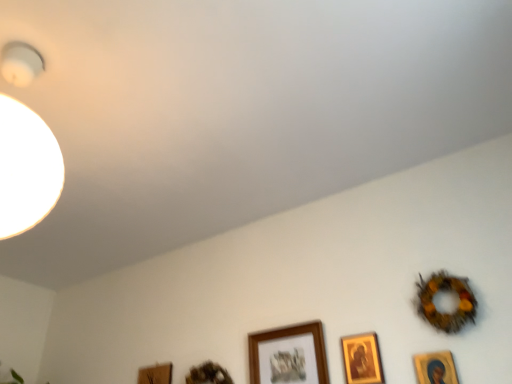
Question: Is gold-framed picture at lower right, arranged as the second picture frame when viewed from the right, shorter than wooden frame at lower center, arranged as the 3th picture frame when viewed from the right?

Choices:
 (A) no
 (B) yes

Answer: (B)

Question: Is gold-framed picture at lower right, arranged as the 4th picture frame when viewed from the left, with wooden frame at lower center, acting as the third picture frame starting from the left?

Choices:
 (A) yes
 (B) no

Answer: (B)

Question: Does gold-framed picture at lower right, arranged as the second picture frame when viewed from the right, have a lesser width compared to wooden frame at lower center, arranged as the 3th picture frame when viewed from the right?

Choices:
 (A) yes
 (B) no

Answer: (A)

Question: Is gold-framed picture at lower right, arranged as the second picture frame when viewed from the right, far from wooden frame at lower center, acting as the third picture frame starting from the left?

Choices:
 (A) no
 (B) yes

Answer: (A)

Question: Does gold-framed picture at lower right, arranged as the 4th picture frame when viewed from the left, have a greater width compared to wooden frame at lower center, acting as the third picture frame starting from the left?

Choices:
 (A) yes
 (B) no

Answer: (B)

Question: Is gold-framed picture at lower right, arranged as the 4th picture frame when viewed from the left, looking in the opposite direction of wooden frame at lower center, arranged as the 3th picture frame when viewed from the right?

Choices:
 (A) no
 (B) yes

Answer: (A)

Question: Does gold-framed picture at lower right, which is counted as the 5th picture frame, starting from the left, lie behind wooden frame at lower center, the 1th picture frame in the left-to-right sequence?

Choices:
 (A) no
 (B) yes

Answer: (A)

Question: From a real-world perspective, does gold-framed picture at lower right, the 1th picture frame from the right, stand above wooden frame at lower center, which is the fifth picture frame from right to left?

Choices:
 (A) yes
 (B) no

Answer: (B)

Question: Is gold-framed picture at lower right, the 1th picture frame from the right, bigger than wooden frame at lower center, which is the fifth picture frame from right to left?

Choices:
 (A) yes
 (B) no

Answer: (B)

Question: Is gold-framed picture at lower right, which is counted as the 5th picture frame, starting from the left, far away from wooden frame at lower center, which is the fifth picture frame from right to left?

Choices:
 (A) yes
 (B) no

Answer: (A)

Question: Is gold-framed picture at lower right, the 1th picture frame from the right, next to wooden frame at lower center, which is the fifth picture frame from right to left, and touching it?

Choices:
 (A) yes
 (B) no

Answer: (B)

Question: Considering the relative sizes of gold-framed picture at lower right, the 1th picture frame from the right, and wooden frame at lower center, the 1th picture frame in the left-to-right sequence, in the image provided, is gold-framed picture at lower right, the 1th picture frame from the right, thinner than wooden frame at lower center, the 1th picture frame in the left-to-right sequence,?

Choices:
 (A) yes
 (B) no

Answer: (A)

Question: Is wooden frame at lower center, which is the fifth picture frame from right to left, taller than wooden frame at lower center, arranged as the 3th picture frame when viewed from the right?

Choices:
 (A) no
 (B) yes

Answer: (A)